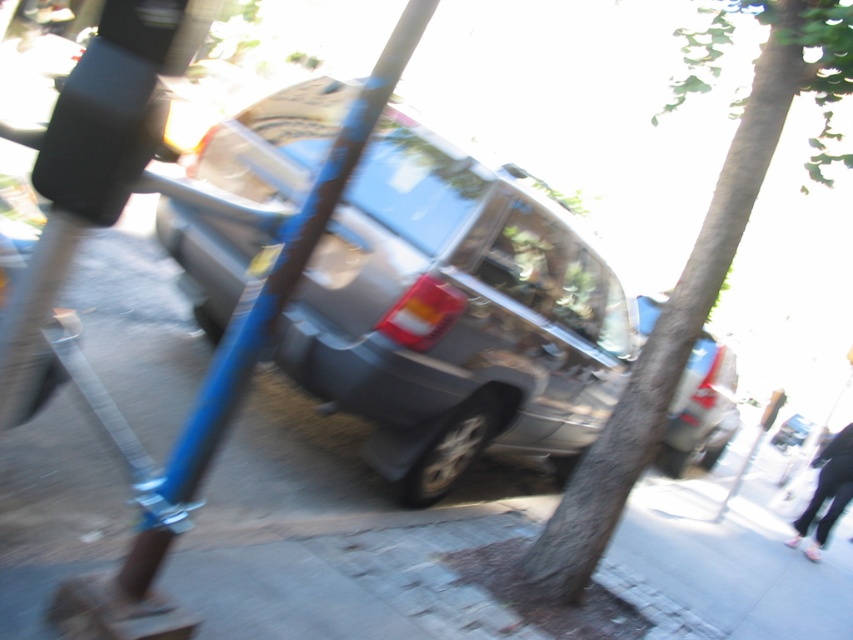
Based on the scene description, where is the gray asphalt pavement at center located in the image?

The gray asphalt pavement at center is located at point (306, 524).

You are standing at a point 13.47 feet away from the point marked at coordinates (561, 365). You want to walk straight towards that point. Is there any object in the image that might block your path?

The path to the point marked at coordinates (561, 365) is blocked by the blue pole leaning towards the left side of the image.